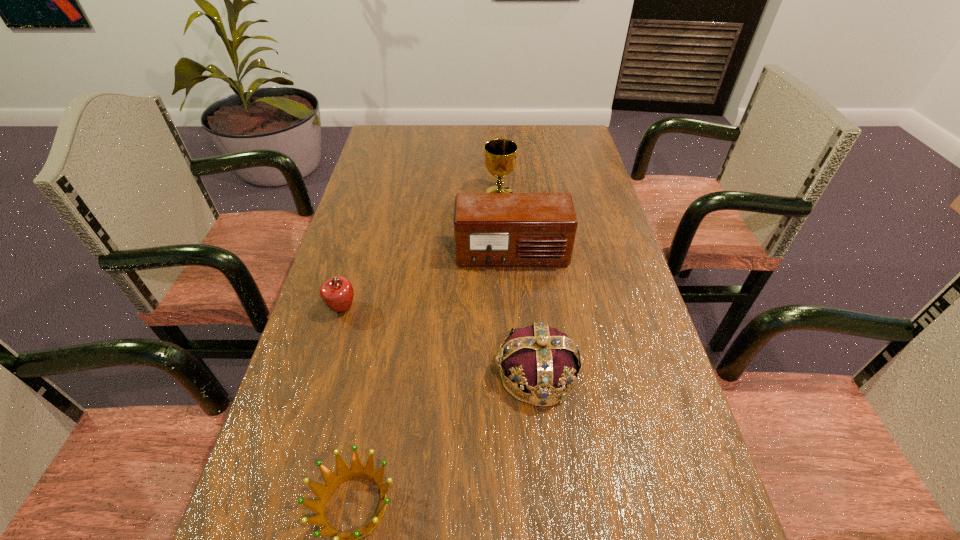
This screenshot has width=960, height=540. In order to click on object that is at the left edge in this screenshot , I will do `click(337, 293)`.

Locate an element on the screen. object at the right edge is located at coordinates (490, 229).

Where is `vacant space at the far edge of the desktop`? Image resolution: width=960 pixels, height=540 pixels. vacant space at the far edge of the desktop is located at coordinates (504, 138).

The image size is (960, 540). I want to click on vacant region at the left edge of the desktop, so click(x=412, y=161).

At what (x,y) coordinates should I click in order to perform the action: click on vacant area at the right edge of the desktop. Please return your answer as a coordinate pair (x, y). Looking at the image, I should click on (607, 292).

The image size is (960, 540). Identify the location of free space at the far left corner. (420, 139).

Where is `empty space that is in between the leftmost object and the fourth nearest object`? The width and height of the screenshot is (960, 540). empty space that is in between the leftmost object and the fourth nearest object is located at coordinates (427, 281).

Where is `free space that is in between the chalice and the apple`? The width and height of the screenshot is (960, 540). free space that is in between the chalice and the apple is located at coordinates (421, 251).

Identify which object is located as the nearest to the fourth tallest object. Please provide its 2D coordinates. Your answer should be formatted as a tuple, i.e. [(x, y)], where the tuple contains the x and y coordinates of a point satisfying the conditions above.

[(490, 229)]

The width and height of the screenshot is (960, 540). Identify the location of object that is the second closest to the farther crown. (490, 229).